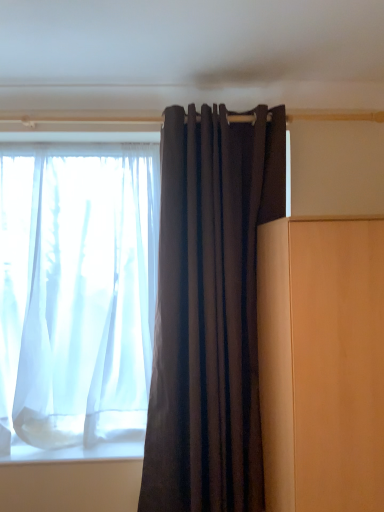
This screenshot has height=512, width=384. What are the coordinates of `sheer white curtain at left, which is counted as the 1th curtain, starting from the back` in the screenshot? It's located at (77, 298).

How much space does dark matte fabric curtain at center, the first curtain positioned from the front, occupy horizontally?

The width of dark matte fabric curtain at center, the first curtain positioned from the front, is 7.01 inches.

Where is `matte wood cabinet at right`? The width and height of the screenshot is (384, 512). matte wood cabinet at right is located at coordinates point(322,362).

Considering the relative positions of matte wood cabinet at right and sheer white curtain at left, which ranks as the second curtain in right-to-left order, in the image provided, is matte wood cabinet at right to the right of sheer white curtain at left, which ranks as the second curtain in right-to-left order, from the viewer's perspective?

Yes, matte wood cabinet at right is to the right of sheer white curtain at left, which ranks as the second curtain in right-to-left order.

From the picture: Which is correct: matte wood cabinet at right is inside sheer white curtain at left, the second curtain in the front-to-back sequence, or outside of it?

The correct answer is: outside.

I want to click on curtain that is the 2nd object located above the matte wood cabinet at right (from the image's perspective), so click(77, 298).

In the scene shown: Can you tell me how much matte wood cabinet at right and sheer white curtain at left, which is counted as the 1th curtain, starting from the back, differ in facing direction?

The angular difference between matte wood cabinet at right and sheer white curtain at left, which is counted as the 1th curtain, starting from the back, is 1.42 degrees.

Considering the relative sizes of matte wood cabinet at right and dark matte fabric curtain at center, which is counted as the 2th curtain, starting from the back, in the image provided, is matte wood cabinet at right bigger than dark matte fabric curtain at center, which is counted as the 2th curtain, starting from the back,?

Correct, matte wood cabinet at right is larger in size than dark matte fabric curtain at center, which is counted as the 2th curtain, starting from the back.

Considering the relative positions of matte wood cabinet at right and dark matte fabric curtain at center, which is counted as the 2th curtain, starting from the back, in the image provided, is matte wood cabinet at right to the left of dark matte fabric curtain at center, which is counted as the 2th curtain, starting from the back, from the viewer's perspective?

No.

Consider the image. From the image's perspective, is matte wood cabinet at right below dark matte fabric curtain at center, the first curtain positioned from the front?

Yes, from the image's perspective, matte wood cabinet at right is below dark matte fabric curtain at center, the first curtain positioned from the front.

Does sheer white curtain at left, marked as the 1th curtain in a left-to-right arrangement, have a larger size compared to dark matte fabric curtain at center, which is the first curtain in right-to-left order?

Correct, sheer white curtain at left, marked as the 1th curtain in a left-to-right arrangement, is larger in size than dark matte fabric curtain at center, which is the first curtain in right-to-left order.

Can you confirm if sheer white curtain at left, marked as the 1th curtain in a left-to-right arrangement, is wider than dark matte fabric curtain at center, which is the first curtain in right-to-left order?

Yes.

Which object is positioned more to the right, sheer white curtain at left, which ranks as the second curtain in right-to-left order, or dark matte fabric curtain at center, the first curtain positioned from the front?

dark matte fabric curtain at center, the first curtain positioned from the front.

From a real-world perspective, does dark matte fabric curtain at center, which is the first curtain in right-to-left order, sit lower than sheer white curtain at left, marked as the 1th curtain in a left-to-right arrangement?

Yes, from a real-world perspective, dark matte fabric curtain at center, which is the first curtain in right-to-left order, is beneath sheer white curtain at left, marked as the 1th curtain in a left-to-right arrangement.

From the picture: How many degrees apart are the facing directions of dark matte fabric curtain at center, which is the first curtain in right-to-left order, and sheer white curtain at left, which is counted as the 1th curtain, starting from the back?

The angular difference between dark matte fabric curtain at center, which is the first curtain in right-to-left order, and sheer white curtain at left, which is counted as the 1th curtain, starting from the back, is 1.79 degrees.

Which object is thinner, dark matte fabric curtain at center, the first curtain positioned from the front, or sheer white curtain at left, the second curtain in the front-to-back sequence?

dark matte fabric curtain at center, the first curtain positioned from the front.

Which of these two, dark matte fabric curtain at center, positioned as the 2th curtain in left-to-right order, or sheer white curtain at left, marked as the 1th curtain in a left-to-right arrangement, is smaller?

With smaller size is dark matte fabric curtain at center, positioned as the 2th curtain in left-to-right order.

Between dark matte fabric curtain at center, which is counted as the 2th curtain, starting from the back, and matte wood cabinet at right, which one has larger width?

matte wood cabinet at right is wider.

Which is correct: dark matte fabric curtain at center, which is the first curtain in right-to-left order, is inside matte wood cabinet at right, or outside of it?

dark matte fabric curtain at center, which is the first curtain in right-to-left order, is spatially situated outside matte wood cabinet at right.

Does point (158, 389) come in front of point (284, 257)?

No, (158, 389) is further to viewer.

Considering the relative sizes of dark matte fabric curtain at center, which is counted as the 2th curtain, starting from the back, and matte wood cabinet at right in the image provided, is dark matte fabric curtain at center, which is counted as the 2th curtain, starting from the back, bigger than matte wood cabinet at right?

No, dark matte fabric curtain at center, which is counted as the 2th curtain, starting from the back, is not bigger than matte wood cabinet at right.

There is a matte wood cabinet at right. In order to click on the 2nd curtain above it (from a real-world perspective) in this screenshot , I will do [77, 298].

Is matte wood cabinet at right located within sheer white curtain at left, which is counted as the 1th curtain, starting from the back?

No, matte wood cabinet at right is not surrounded by sheer white curtain at left, which is counted as the 1th curtain, starting from the back.

Between sheer white curtain at left, which ranks as the second curtain in right-to-left order, and matte wood cabinet at right, which one has smaller size?

sheer white curtain at left, which ranks as the second curtain in right-to-left order.

In the scene shown: Does sheer white curtain at left, the second curtain in the front-to-back sequence, appear on the right side of matte wood cabinet at right?

No, sheer white curtain at left, the second curtain in the front-to-back sequence, is not to the right of matte wood cabinet at right.

From a real-world perspective, starting from the matte wood cabinet at right, which curtain is the 2nd one vertically above it? Please provide its 2D coordinates.

[(77, 298)]

In the image, there is a dark matte fabric curtain at center, positioned as the 2th curtain in left-to-right order. Where is `furniture below it (from the image's perspective)`? This screenshot has width=384, height=512. furniture below it (from the image's perspective) is located at coordinates (322, 362).

Considering their positions, is dark matte fabric curtain at center, the first curtain positioned from the front, positioned closer to matte wood cabinet at right than sheer white curtain at left, the second curtain in the front-to-back sequence?

dark matte fabric curtain at center, the first curtain positioned from the front, lies closer to matte wood cabinet at right than the other object.

Based on their spatial positions, is dark matte fabric curtain at center, positioned as the 2th curtain in left-to-right order, or matte wood cabinet at right closer to sheer white curtain at left, marked as the 1th curtain in a left-to-right arrangement?

dark matte fabric curtain at center, positioned as the 2th curtain in left-to-right order.

From the image, which object appears to be nearer to sheer white curtain at left, the second curtain in the front-to-back sequence, matte wood cabinet at right or dark matte fabric curtain at center, positioned as the 2th curtain in left-to-right order?

dark matte fabric curtain at center, positioned as the 2th curtain in left-to-right order.

Estimate the real-world distances between objects in this image. Which object is closer to dark matte fabric curtain at center, which is the first curtain in right-to-left order, matte wood cabinet at right or sheer white curtain at left, the second curtain in the front-to-back sequence?

sheer white curtain at left, the second curtain in the front-to-back sequence, is positioned closer to the anchor dark matte fabric curtain at center, which is the first curtain in right-to-left order.

Estimate the real-world distances between objects in this image. Which object is closer to dark matte fabric curtain at center, the first curtain positioned from the front, sheer white curtain at left, which ranks as the second curtain in right-to-left order, or matte wood cabinet at right?

The object closer to dark matte fabric curtain at center, the first curtain positioned from the front, is sheer white curtain at left, which ranks as the second curtain in right-to-left order.

From the image, which object appears to be nearer to matte wood cabinet at right, sheer white curtain at left, the second curtain in the front-to-back sequence, or dark matte fabric curtain at center, which is counted as the 2th curtain, starting from the back?

dark matte fabric curtain at center, which is counted as the 2th curtain, starting from the back, is closer to matte wood cabinet at right.

Locate an element on the screen. This screenshot has width=384, height=512. curtain situated between sheer white curtain at left, the second curtain in the front-to-back sequence, and matte wood cabinet at right from left to right is located at coordinates (210, 310).